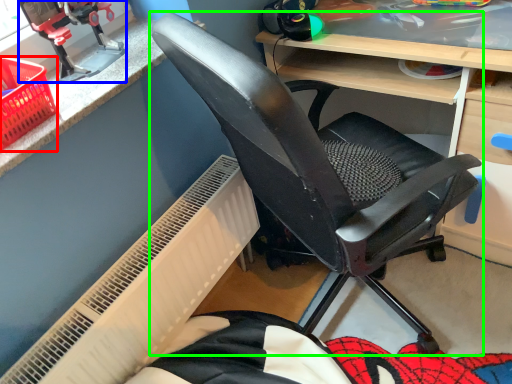
Question: Which is farther away from basket (highlighted by a red box)? sport equipment (highlighted by a blue box) or chair (highlighted by a green box)?

Choices:
 (A) sport equipment
 (B) chair

Answer: (B)